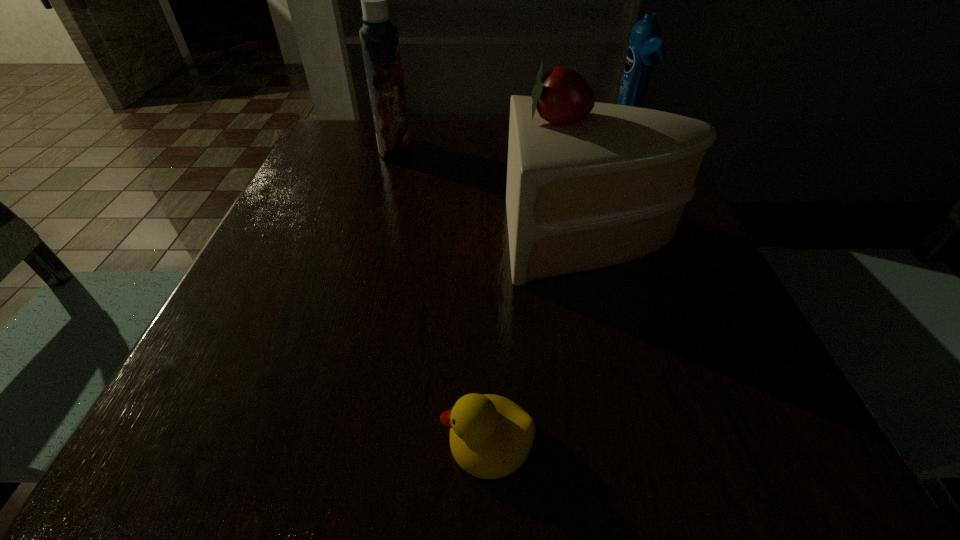
I want to click on vacant region located 0.090m on the face of the second farthest gray watch, so click(x=595, y=283).

At what (x,y) coordinates should I click in order to perform the action: click on blank space located 0.220m on the face of the second farthest gray watch. Please return your answer as a coordinate pair (x, y). This screenshot has width=960, height=540. Looking at the image, I should click on (514, 283).

At what (x,y) coordinates should I click in order to perform the action: click on vacant space positioned on the face of the smallest gold watch. Please return your answer as a coordinate pair (x, y). Image resolution: width=960 pixels, height=540 pixels. Looking at the image, I should click on (438, 408).

At what (x,y) coordinates should I click in order to perform the action: click on sunflower located in the far edge section of the desktop. Please return your answer as a coordinate pair (x, y). Looking at the image, I should click on (370, 121).

At what (x,y) coordinates should I click in order to perform the action: click on hourglass located at the far edge. Please return your answer as a coordinate pair (x, y). The image size is (960, 540). Looking at the image, I should click on tap(648, 95).

Where is `sunflower that is positioned at the left edge`? The width and height of the screenshot is (960, 540). sunflower that is positioned at the left edge is located at coordinates (370, 121).

At what (x,y) coordinates should I click in order to perform the action: click on hourglass located in the right edge section of the desktop. Please return your answer as a coordinate pair (x, y). The image size is (960, 540). Looking at the image, I should click on (648, 95).

The image size is (960, 540). I want to click on object at the far left corner, so click(370, 121).

Where is `object positioned at the near left corner`? object positioned at the near left corner is located at coordinates (273, 383).

Identify the location of object located at the far right corner. This screenshot has height=540, width=960. (x=648, y=95).